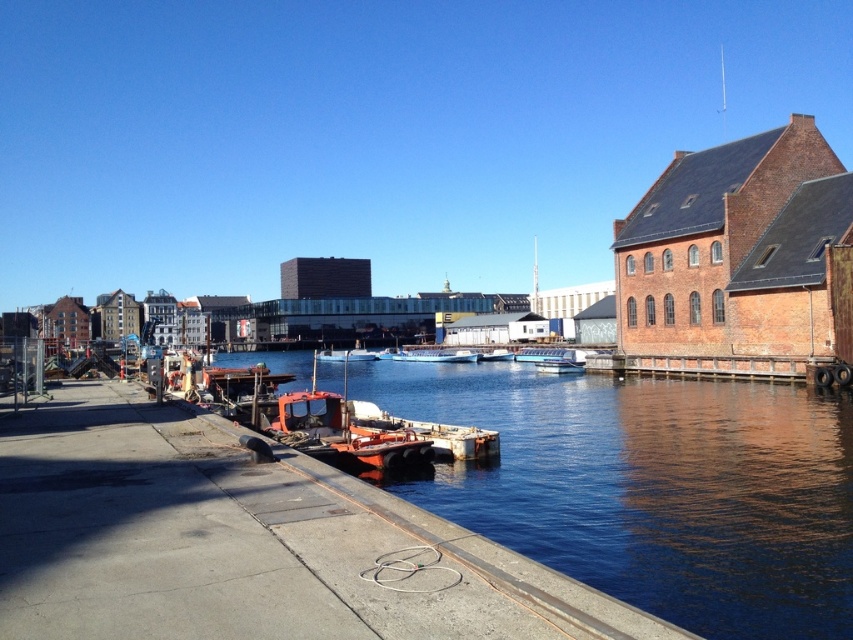
Question: Does blue water at lower left have a greater width compared to smooth wooden boat at center?

Choices:
 (A) yes
 (B) no

Answer: (A)

Question: Which object appears closest to the camera in this image?

Choices:
 (A) smooth wooden boat at center
 (B) white matte boat at center
 (C) metallic orange boat at center
 (D) white plastic boat at center

Answer: (D)

Question: Estimate the real-world distances between objects in this image. Which object is closer to the smooth wooden boat at center?

Choices:
 (A) metallic orange boat at center
 (B) metallic silver boat at center

Answer: (B)

Question: Which is nearer to the metallic silver boat at center?

Choices:
 (A) white plastic boat at center
 (B) metallic orange boat at center
 (C) smooth wooden boat at center
 (D) white matte boat at center

Answer: (A)

Question: Does blue water at lower left appear under white plastic boat at center?

Choices:
 (A) yes
 (B) no

Answer: (A)

Question: Does blue water at lower left appear on the right side of metallic silver boat at center?

Choices:
 (A) yes
 (B) no

Answer: (B)